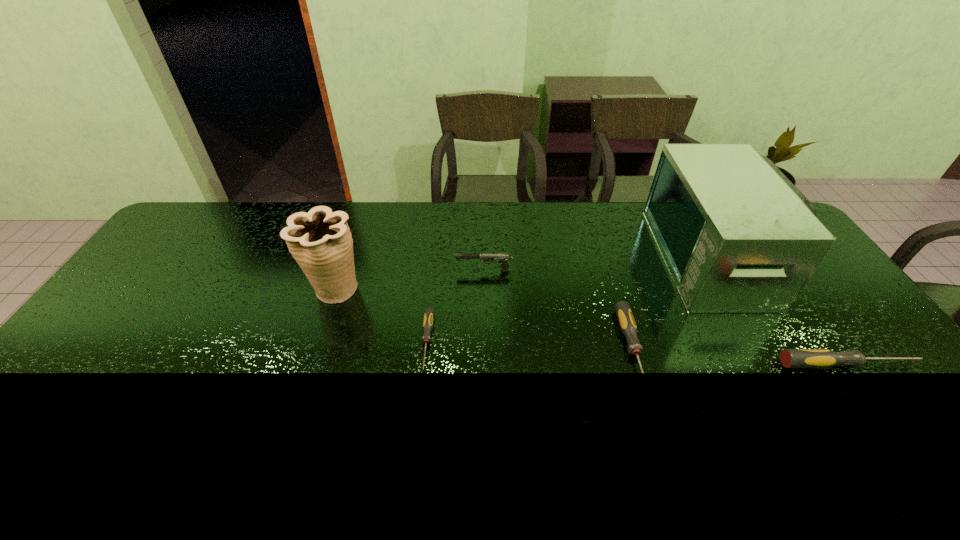
I want to click on the fifth object from right to left, so click(429, 312).

Identify the location of the leftmost screwdriver. (429, 312).

This screenshot has width=960, height=540. What are the coordinates of `the fourth object from left to right` in the screenshot? It's located at (625, 317).

Locate an element on the screen. This screenshot has width=960, height=540. the second shortest object is located at coordinates (625, 317).

Where is `the rightmost screwdriver`? This screenshot has width=960, height=540. the rightmost screwdriver is located at coordinates (790, 358).

The height and width of the screenshot is (540, 960). What are the coordinates of `gun` in the screenshot? It's located at (503, 258).

Where is `the third object from left to right`? The width and height of the screenshot is (960, 540). the third object from left to right is located at coordinates (503, 258).

This screenshot has width=960, height=540. What are the coordinates of `microwave oven` in the screenshot? It's located at (737, 236).

I want to click on the leftmost object, so click(x=320, y=241).

Find the location of `vacant region located insert the shortest object into a screw head`. vacant region located insert the shortest object into a screw head is located at coordinates (420, 401).